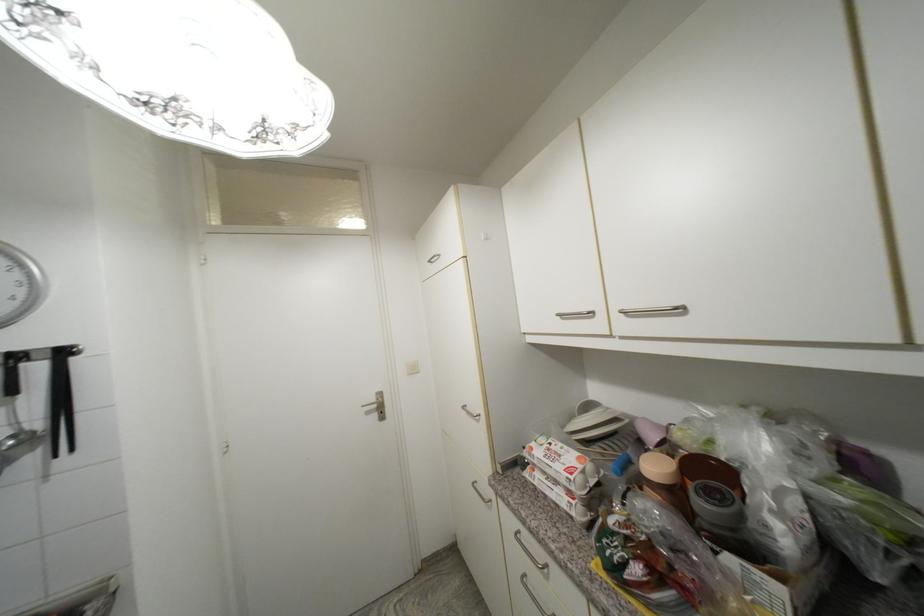
Find where to lift the brown jar with lid. Please return your answer as a coordinate pair (x, y).

(664, 482)